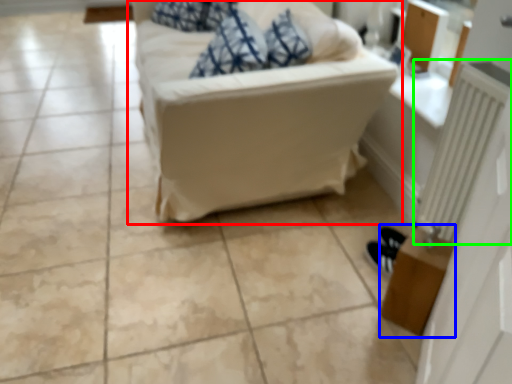
Question: Based on their relative distances, which object is farther from studio couch (highlighted by a red box)? Choose from table (highlighted by a blue box) and radiator (highlighted by a green box).

Choices:
 (A) table
 (B) radiator

Answer: (A)